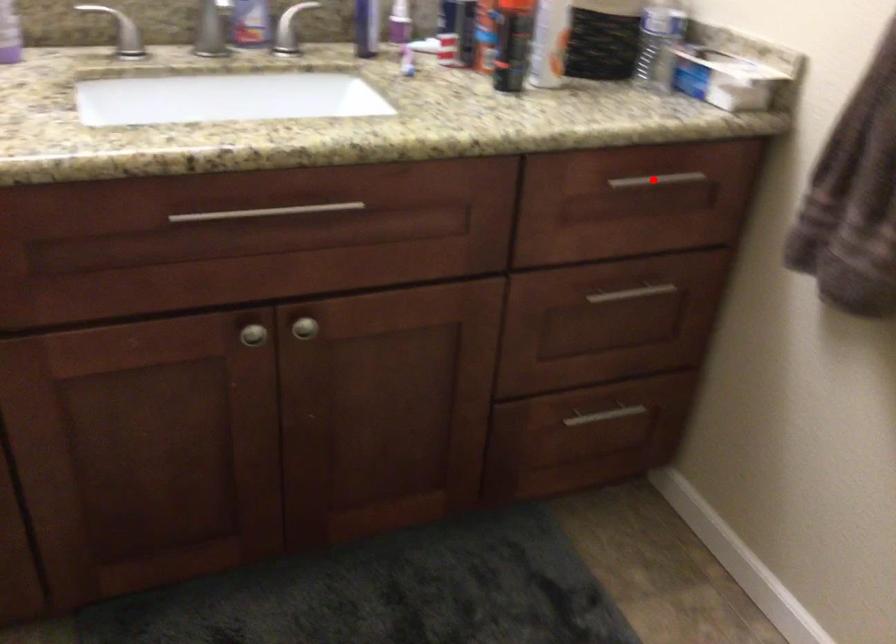
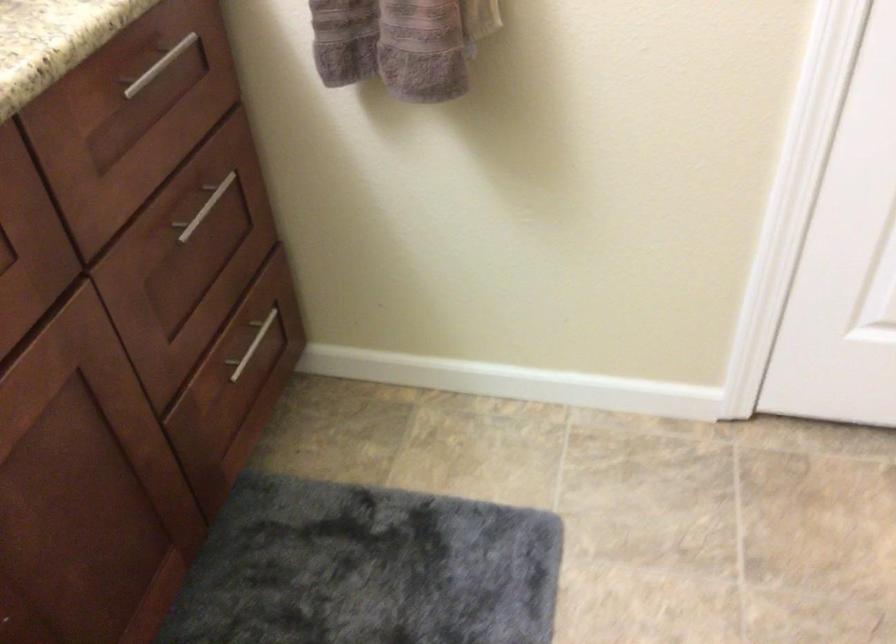
Question: I am providing you with two images of the same scene from different viewpoints. Image1 has a red point marked. In image2, the corresponding 3D location appears at what relative position? Reply with the corresponding letter.

Choices:
 (A) Closer
 (B) Farther

Answer: (A)